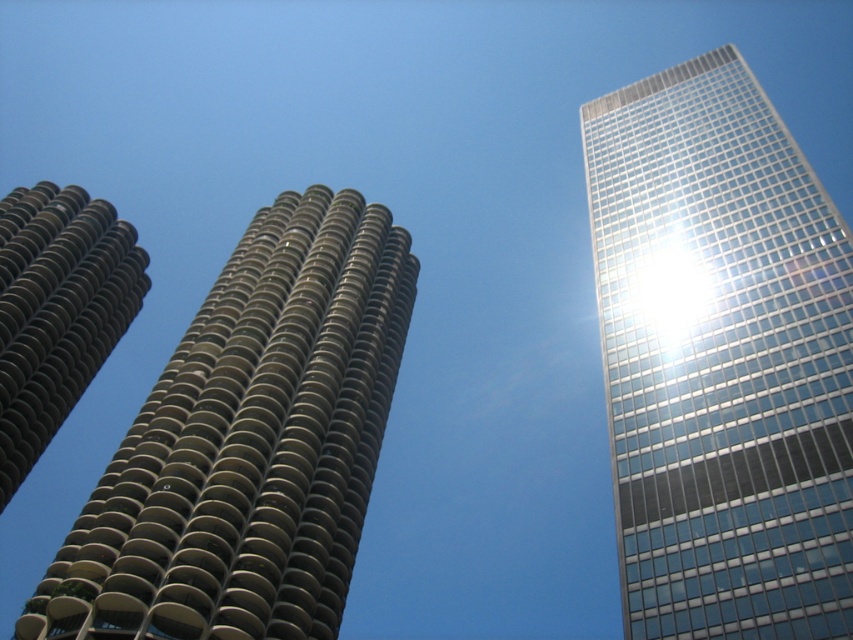
Consider the image. You are standing at the base of the three skyscrapers in the image. Looking up, you notice a point marked at coordinates (721, 358). Which skyscraper does this point belong to?

The point at coordinates (721, 358) corresponds to the transparent glass skyscraper at upper right.